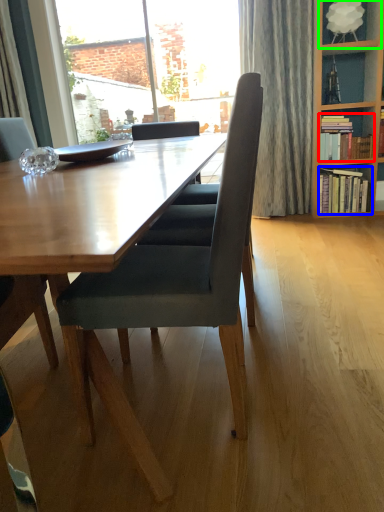
Question: Which object is the farthest from book (highlighted by a red box)? Choose among these: book (highlighted by a blue box) or shelf (highlighted by a green box).

Choices:
 (A) book
 (B) shelf

Answer: (B)